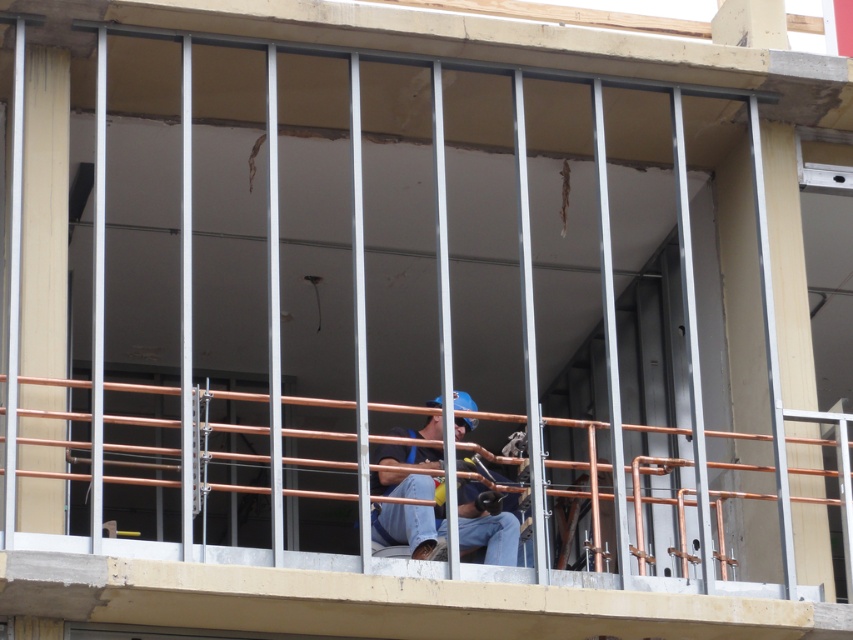
Is copper pipe railing at center below blue hard hat at center?

Correct, copper pipe railing at center is located below blue hard hat at center.

Which is more to the right, copper pipe railing at center or blue hard hat at center?

blue hard hat at center is more to the right.

Describe the element at coordinates (381, 595) in the screenshot. I see `copper pipe railing at center` at that location.

This screenshot has height=640, width=853. What are the coordinates of `copper pipe railing at center` in the screenshot? It's located at [381, 595].